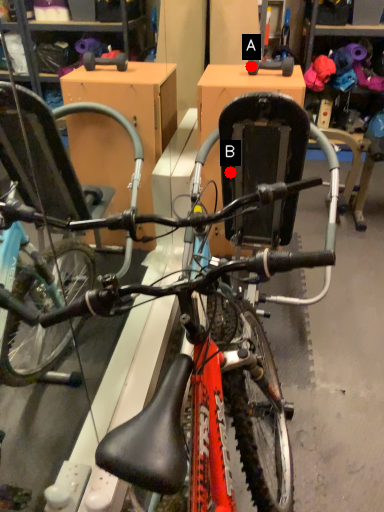
Question: Two points are circled on the image, labeled by A and B beside each circle. Which point appears farthest from the camera in this image?

Choices:
 (A) A is further
 (B) B is further

Answer: (A)